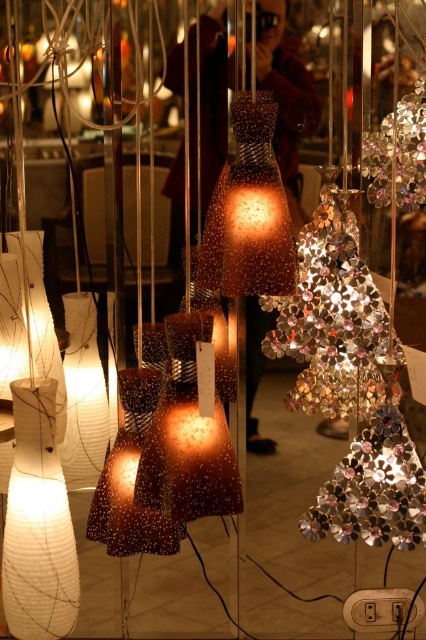
You are a customer in a store looking at the display of decorative light fixtures. You see the shiny metallic ornament at center and the shiny metallic garland at right. Which one takes up more space in the display?

The shiny metallic ornament at center takes up more space in the display because it is bigger than the shiny metallic garland at right.

You are a customer in the store and want to see both the shiny metallic ornament at center and the shiny metallic garland at right. Which one would you have to look past to get a clear view of the other?

To see the shiny metallic garland at right clearly, you would have to look past the shiny metallic ornament at center since the garland is positioned behind it.